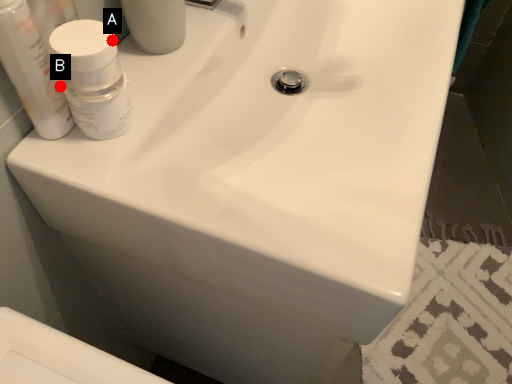
Question: Two points are circled on the image, labeled by A and B beside each circle. Among these points, which one is farthest from the camera?

Choices:
 (A) A is further
 (B) B is further

Answer: (B)